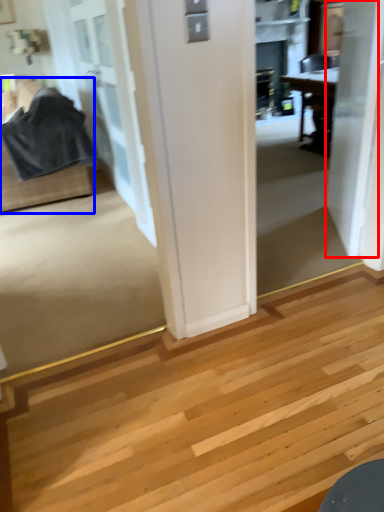
Question: Which of the following is the closest to the observer, door (highlighted by a red box) or furniture (highlighted by a blue box)?

Choices:
 (A) door
 (B) furniture

Answer: (A)